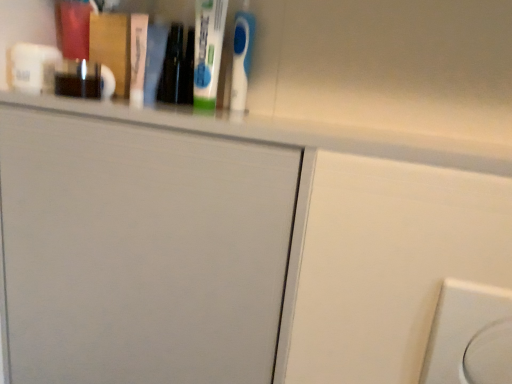
What do you see at coordinates (141, 252) in the screenshot? The width and height of the screenshot is (512, 384). I see `white matte door at upper center` at bounding box center [141, 252].

Where is `white glossy ledge at upper center`? This screenshot has width=512, height=384. white glossy ledge at upper center is located at coordinates (289, 132).

Could you tell me if white glossy ledge at upper center is facing white matte door at upper center?

No, white glossy ledge at upper center is not aimed at white matte door at upper center.

Considering the sizes of objects white glossy ledge at upper center and white matte door at upper center in the image provided, who is shorter, white glossy ledge at upper center or white matte door at upper center?

white glossy ledge at upper center.

Does point (169, 120) come in front of point (249, 357)?

Yes.

From a real-world perspective, which object stands above the other?

white glossy ledge at upper center.

Considering the relative sizes of white matte door at upper center and white glossy ledge at upper center in the image provided, is white matte door at upper center bigger than white glossy ledge at upper center?

Yes.

In the image, is white matte door at upper center on the left side or the right side of white glossy ledge at upper center?

Clearly, white matte door at upper center is on the left of white glossy ledge at upper center in the image.

Is white matte door at upper center facing towards white glossy ledge at upper center?

No, white matte door at upper center is not aimed at white glossy ledge at upper center.

Is white matte door at upper center thinner than white glossy ledge at upper center?

Indeed, white matte door at upper center has a lesser width compared to white glossy ledge at upper center.

Can you confirm if white plastic electric outlet at lower right is shorter than white glossy ledge at upper center?

No, white plastic electric outlet at lower right is not shorter than white glossy ledge at upper center.

At what (x,y) coordinates should I click in order to perform the action: click on ledge above the white plastic electric outlet at lower right (from a real-world perspective). Please return your answer as a coordinate pair (x, y). Looking at the image, I should click on (289, 132).

Would you say white plastic electric outlet at lower right is a long distance from white glossy ledge at upper center?

Actually, white plastic electric outlet at lower right and white glossy ledge at upper center are a little close together.

Is white plastic electric outlet at lower right closer to camera compared to white glossy ledge at upper center?

Yes, white plastic electric outlet at lower right is in front of white glossy ledge at upper center.

Between white matte door at upper center and white plastic electric outlet at lower right, which one has smaller size?

With smaller size is white plastic electric outlet at lower right.

Where is `door behind the white plastic electric outlet at lower right`? This screenshot has width=512, height=384. door behind the white plastic electric outlet at lower right is located at coordinates (141, 252).

From the image's perspective, which is below, white matte door at upper center or white plastic electric outlet at lower right?

white plastic electric outlet at lower right is shown below in the image.

Which object is positioned more to the left, white matte door at upper center or white plastic electric outlet at lower right?

From the viewer's perspective, white matte door at upper center appears more on the left side.

Would you say white plastic electric outlet at lower right is inside or outside white matte door at upper center?

white plastic electric outlet at lower right is outside white matte door at upper center.

Are white plastic electric outlet at lower right and white matte door at upper center far apart?

They are positioned close to each other.

Is white plastic electric outlet at lower right to the left or to the right of white matte door at upper center in the image?

white plastic electric outlet at lower right is to the right of white matte door at upper center.

Which is nearer, (446, 290) or (189, 368)?

Clearly, point (446, 290) is closer to the camera than point (189, 368).

From the image's perspective, which is above, white glossy ledge at upper center or white plastic electric outlet at lower right?

white glossy ledge at upper center appears higher in the image.

Is point (308, 122) farther from viewer compared to point (439, 299)?

Yes, it is behind point (439, 299).

Can you confirm if white glossy ledge at upper center is shorter than white plastic electric outlet at lower right?

Correct, white glossy ledge at upper center is not as tall as white plastic electric outlet at lower right.

Identify the location of ledge located above the white matte door at upper center (from the image's perspective). This screenshot has width=512, height=384. (289, 132).

At what (x,y) coordinates should I click in order to perform the action: click on door that appears behind the white glossy ledge at upper center. Please return your answer as a coordinate pair (x, y). This screenshot has height=384, width=512. Looking at the image, I should click on (141, 252).

Looking at the image, which one is located further to white matte door at upper center, white plastic electric outlet at lower right or white glossy ledge at upper center?

Based on the image, white plastic electric outlet at lower right appears to be further to white matte door at upper center.

When comparing their distances from white matte door at upper center, does white glossy ledge at upper center or white plastic electric outlet at lower right seem further?

Among the two, white plastic electric outlet at lower right is located further to white matte door at upper center.

Based on their spatial positions, is white plastic electric outlet at lower right or white matte door at upper center closer to white glossy ledge at upper center?

white matte door at upper center lies closer to white glossy ledge at upper center than the other object.

Looking at the image, which one is located further to white plastic electric outlet at lower right, white matte door at upper center or white glossy ledge at upper center?

white matte door at upper center is positioned further to the anchor white plastic electric outlet at lower right.

When comparing their distances from white glossy ledge at upper center, does white matte door at upper center or white plastic electric outlet at lower right seem closer?

white matte door at upper center.

Based on their spatial positions, is white glossy ledge at upper center or white matte door at upper center closer to white plastic electric outlet at lower right?

white glossy ledge at upper center lies closer to white plastic electric outlet at lower right than the other object.

The image size is (512, 384). Find the location of `ledge between white matte door at upper center and white plastic electric outlet at lower right from left to right`. ledge between white matte door at upper center and white plastic electric outlet at lower right from left to right is located at coordinates (289, 132).